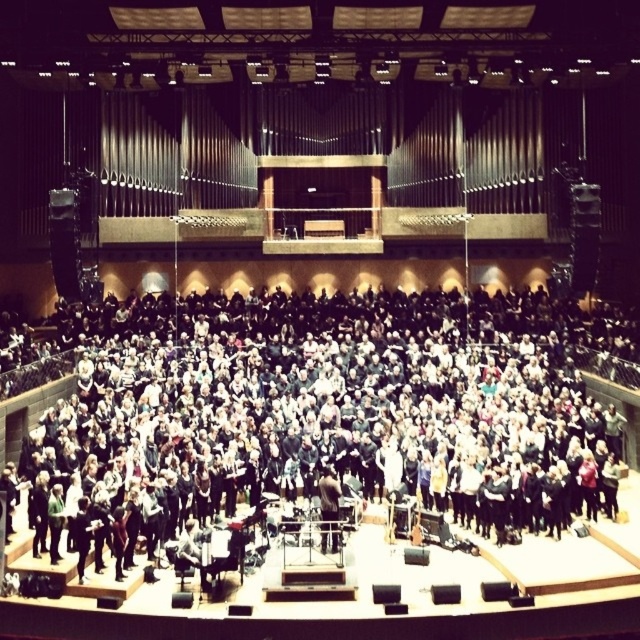
Between point (417, 404) and point (323, 472), which one is positioned in front?

Point (323, 472) is more forward.

Does black fabric at center have a lesser width compared to dark brown leather jacket at center?

In fact, black fabric at center might be wider than dark brown leather jacket at center.

Does point (516, 445) come in front of point (324, 541)?

No, it is not.

Where is `black fabric at center`? The height and width of the screenshot is (640, 640). black fabric at center is located at coordinates (332, 417).